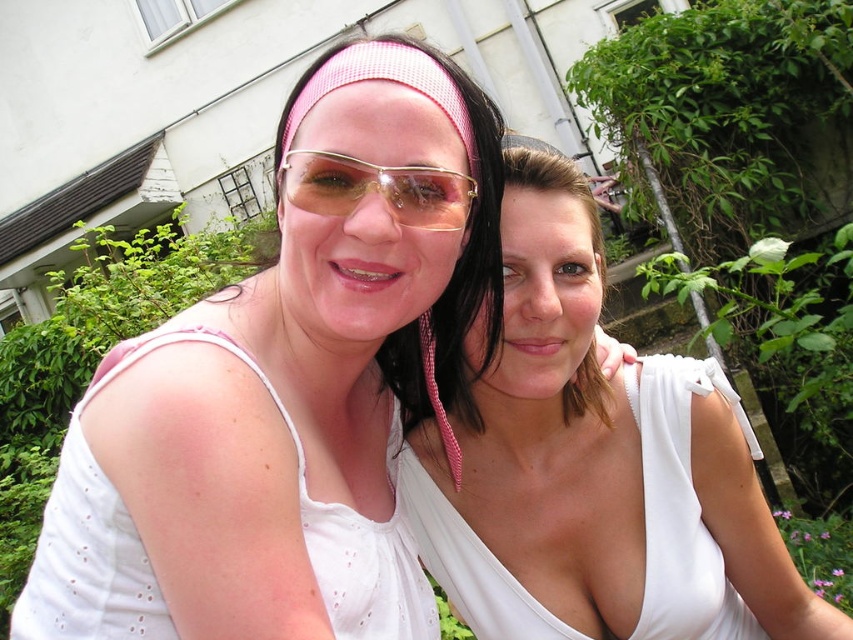
You are a photographer trying to capture the matte white tank top at center and the white silky dress at center in a photo. Since both are at the center, can you tell which one is covering the other?

The matte white tank top at center is positioned over the white silky dress at center, so it is covering the dress.

You are standing at the point marked as point (80, 442) and want to take a photo of the two people in the scene. If your camera can focus on objects within 30 inches, will it be able to capture them clearly?

The distance between point (80, 442) and the camera is 28.18 inches, which is within the camera focus range of 30 inches. Therefore, the camera can capture the two people clearly.

You are a photographer trying to capture a clear shot of both the matte white tank top at center and the white silky dress at center. Since both are positioned at the center, which one do you think will be more visible in the photo?

The matte white tank top at center is in front of the white silky dress at center, so it will be more visible in the photo.